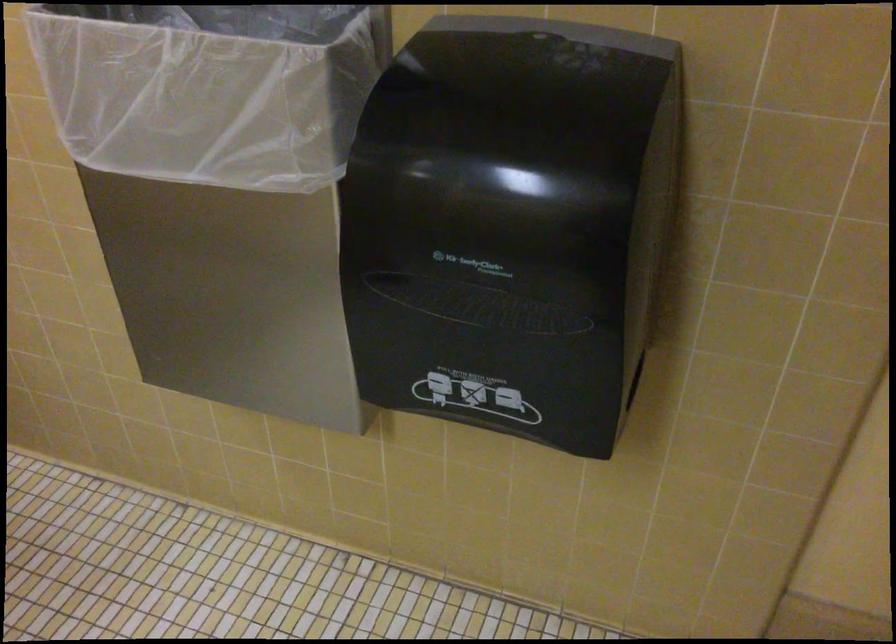
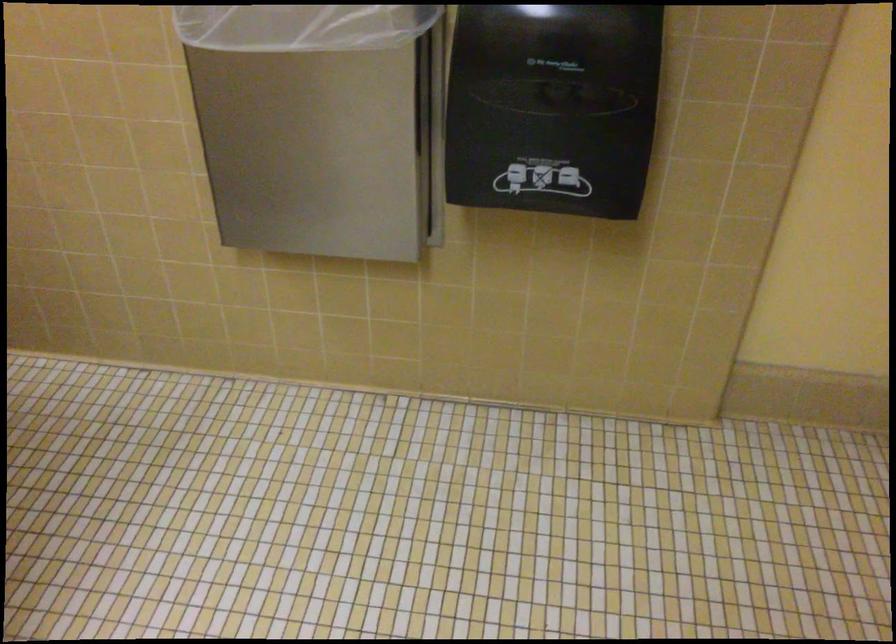
Find the pixel in the second image that matches point (526, 275) in the first image.

(552, 107)